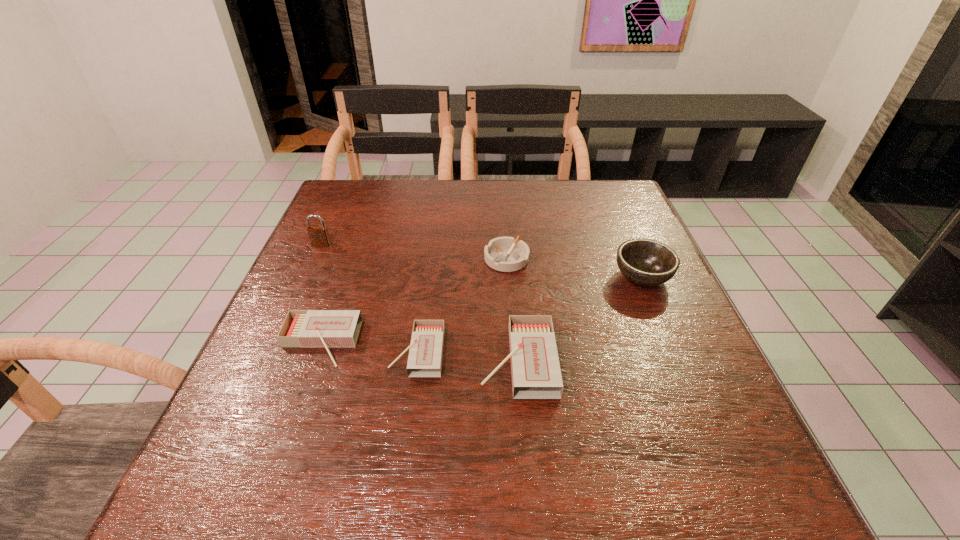
Find the location of a particular element. vacant point located between the ashtray and the rightmost matchbox is located at coordinates (512, 309).

This screenshot has height=540, width=960. What are the coordinates of `free space between the rightmost matchbox and the padlock` in the screenshot? It's located at (420, 302).

Where is `blank region between the shortest matchbox and the rightmost matchbox`? Image resolution: width=960 pixels, height=540 pixels. blank region between the shortest matchbox and the rightmost matchbox is located at coordinates (468, 356).

Where is `empty space between the rightmost matchbox and the padlock`? The height and width of the screenshot is (540, 960). empty space between the rightmost matchbox and the padlock is located at coordinates (420, 302).

Locate an element on the screen. The width and height of the screenshot is (960, 540). unoccupied position between the shortest matchbox and the padlock is located at coordinates (370, 298).

Locate an element on the screen. free space between the ashtray and the third object from left to right is located at coordinates click(462, 305).

Locate an element on the screen. This screenshot has width=960, height=540. free point between the rightmost object and the ashtray is located at coordinates (574, 268).

Identify which object is the closest to the rightmost matchbox. Please provide its 2D coordinates. Your answer should be formatted as a tuple, i.e. [(x, y)], where the tuple contains the x and y coordinates of a point satisfying the conditions above.

[(426, 348)]

Identify which object is the second closest to the rightmost matchbox. Please provide its 2D coordinates. Your answer should be formatted as a tuple, i.e. [(x, y)], where the tuple contains the x and y coordinates of a point satisfying the conditions above.

[(505, 254)]

The image size is (960, 540). What are the coordinates of `matchbox identified as the closest to the second matchbox from right to left` in the screenshot? It's located at (301, 328).